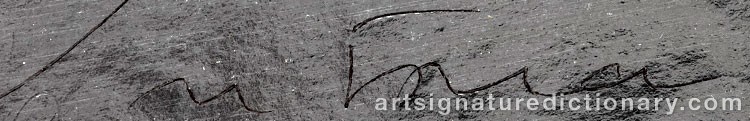
Identify the location of surface. (231, 41).